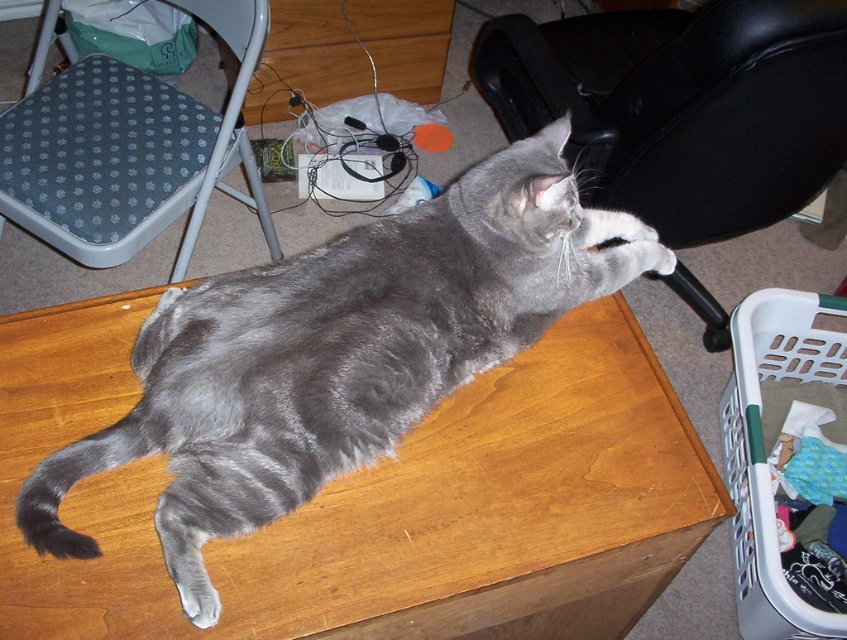
Question: Among these points, which one is nearest to the camera?

Choices:
 (A) (224, 140)
 (B) (687, 20)

Answer: (A)

Question: Observing the image, what is the correct spatial positioning of black leather swivel chair at upper right in reference to metallic gray swivel chair at upper left?

Choices:
 (A) left
 (B) right

Answer: (B)

Question: Is metallic gray swivel chair at upper left further to the viewer compared to white plastic laundry basket at lower right?

Choices:
 (A) yes
 (B) no

Answer: (B)

Question: Which point is farther to the camera?

Choices:
 (A) (222, 536)
 (B) (639, 20)
 (C) (37, 157)

Answer: (B)

Question: Does black leather swivel chair at upper right have a larger size compared to white plastic laundry basket at lower right?

Choices:
 (A) yes
 (B) no

Answer: (A)

Question: Which is nearer to the metallic gray swivel chair at upper left?

Choices:
 (A) black leather swivel chair at upper right
 (B) white plastic laundry basket at lower right

Answer: (A)